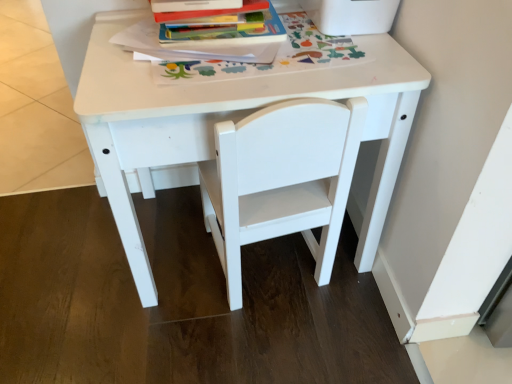
The height and width of the screenshot is (384, 512). I want to click on vacant space situated on the left part of white matte table at center, so click(67, 263).